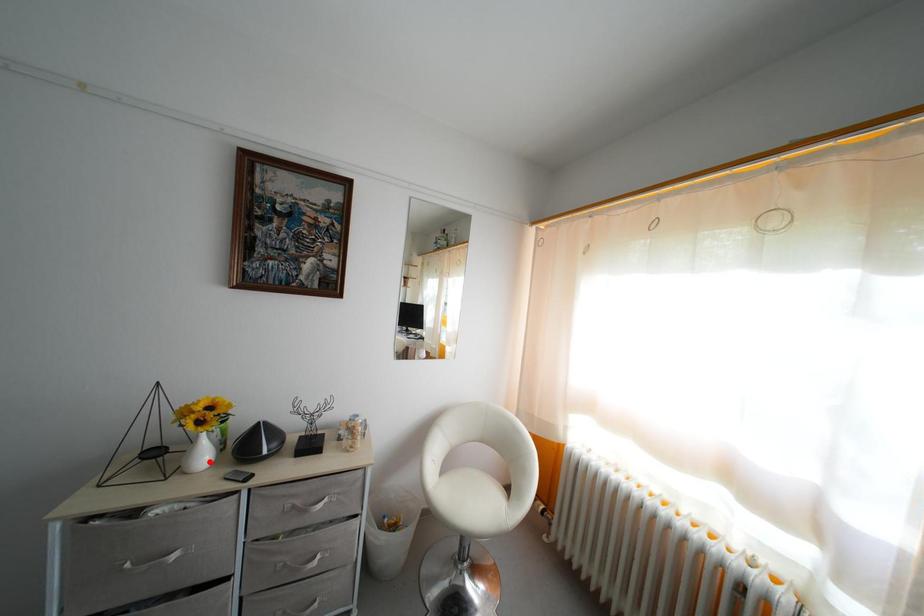
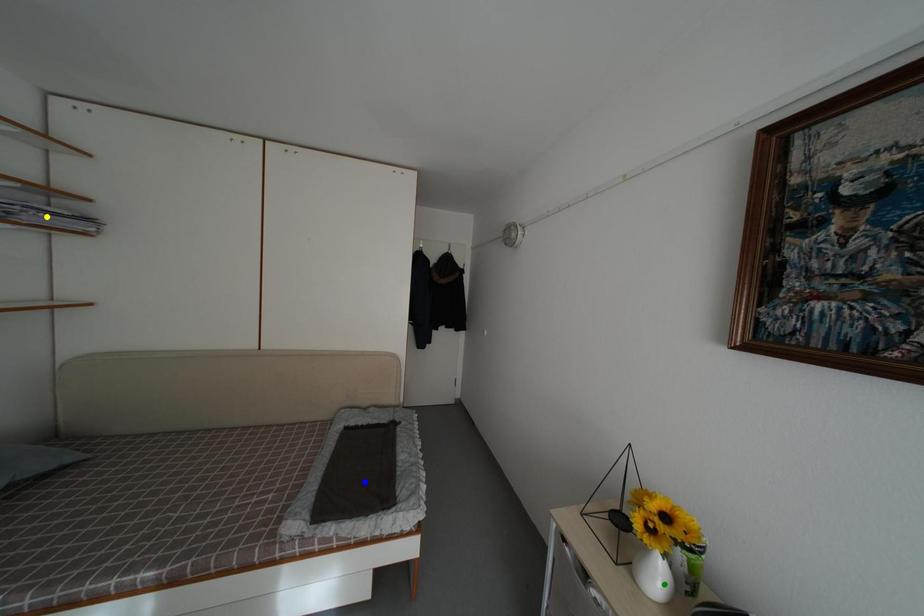
Question: I am providing you with two images of the same scene from different viewpoints. A red point is marked on the first image. You are given multiple points on the second image. Which mark in image 2 goes with the point in image 1?

Choices:
 (A) green point
 (B) yellow point
 (C) blue point

Answer: (A)